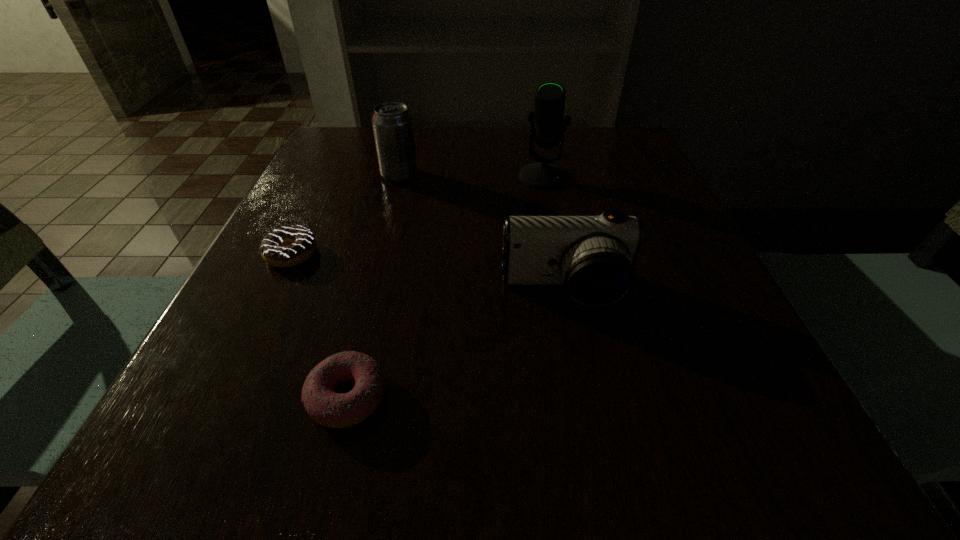
Where is `vacant space located on the back of the right doughnut`? Image resolution: width=960 pixels, height=540 pixels. vacant space located on the back of the right doughnut is located at coordinates (378, 276).

The image size is (960, 540). Identify the location of free space located 0.150m on the front of the leftmost object. (250, 341).

At what (x,y) coordinates should I click in order to perform the action: click on microphone situated at the far edge. Please return your answer as a coordinate pair (x, y). The height and width of the screenshot is (540, 960). Looking at the image, I should click on (547, 118).

Locate an element on the screen. soda can that is at the far edge is located at coordinates (392, 123).

Find the location of `object that is positioned at the near edge`. object that is positioned at the near edge is located at coordinates (335, 410).

Locate an element on the screen. This screenshot has width=960, height=540. object present at the left edge is located at coordinates (287, 246).

Where is `object situated at the right edge`? The height and width of the screenshot is (540, 960). object situated at the right edge is located at coordinates (593, 257).

This screenshot has height=540, width=960. I want to click on free space at the far edge of the desktop, so pos(507,141).

The image size is (960, 540). In the image, there is a desktop. In order to click on vacant space at the near edge in this screenshot , I will do `click(482, 463)`.

Find the location of `vacant space at the left edge`. vacant space at the left edge is located at coordinates click(x=324, y=260).